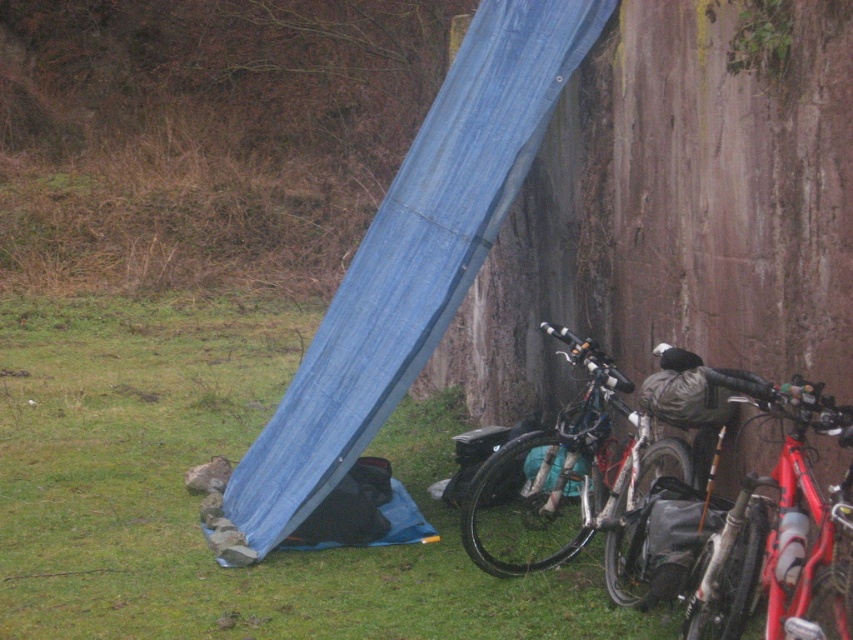
Question: Can you confirm if red matte bicycle at right is wider than silver metallic bicycle at center?

Choices:
 (A) no
 (B) yes

Answer: (A)

Question: Which of the following is the farthest from the observer?

Choices:
 (A) silver metallic bicycle at center
 (B) blue tarp at lower left
 (C) red matte bicycle at right

Answer: (B)

Question: In this image, where is blue tarp at lower left located relative to red matte bicycle at right?

Choices:
 (A) below
 (B) above

Answer: (B)

Question: Does red matte bicycle at right have a larger size compared to silver metallic bicycle at center?

Choices:
 (A) yes
 (B) no

Answer: (B)

Question: Among these points, which one is farthest from the camera?

Choices:
 (A) (247, 464)
 (B) (521, 496)
 (C) (807, 618)

Answer: (A)

Question: Which of the following is the closest to the observer?

Choices:
 (A) red matte bicycle at right
 (B) blue tarp at lower left

Answer: (A)